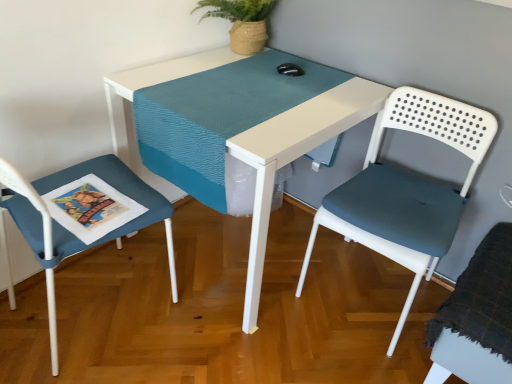
This screenshot has height=384, width=512. What are the coordinates of `empty space that is in between white plastic chair at right, which appears as the second chair when viewed from the right, and white plastic table at center` in the screenshot? It's located at (310, 336).